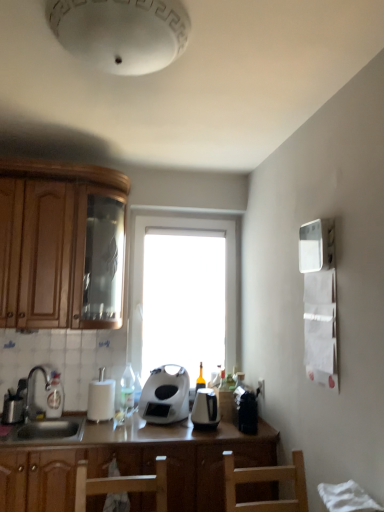
The height and width of the screenshot is (512, 384). I want to click on free space in front of white matte paper towel holder at center, so click(x=91, y=424).